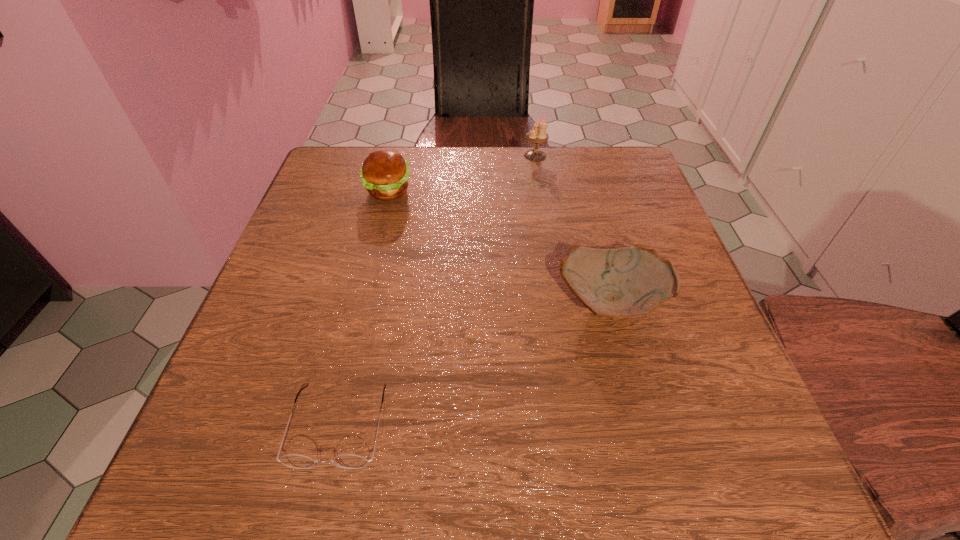
Locate an element on the screen. This screenshot has width=960, height=540. vacant space located on the left of the pottery is located at coordinates (435, 303).

In order to click on candle holder present at the far edge in this screenshot , I will do `click(538, 134)`.

Locate an element on the screen. The image size is (960, 540). hamburger that is at the far edge is located at coordinates (384, 173).

At what (x,y) coordinates should I click in order to perform the action: click on object at the near edge. Please return your answer as a coordinate pair (x, y). The image size is (960, 540). Looking at the image, I should click on (347, 461).

Where is `hamburger positioned at the left edge`? Image resolution: width=960 pixels, height=540 pixels. hamburger positioned at the left edge is located at coordinates (384, 173).

In order to click on spectacles located in the left edge section of the desktop in this screenshot , I will do `click(347, 461)`.

Find the location of a particular element. The image size is (960, 540). object present at the right edge is located at coordinates (629, 282).

Image resolution: width=960 pixels, height=540 pixels. In order to click on object that is at the far left corner in this screenshot , I will do `click(384, 173)`.

Locate an element on the screen. object that is at the near left corner is located at coordinates (347, 461).

In order to click on free space at the far edge in this screenshot , I will do `click(420, 156)`.